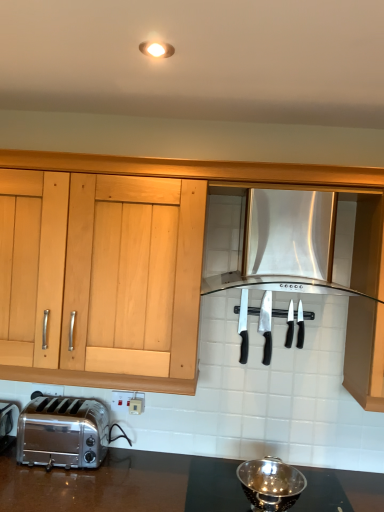
What do you see at coordinates (266, 325) in the screenshot? I see `polished stainless steel knife at center, the 2th silverware from the left` at bounding box center [266, 325].

Find the location of a particular element. This screenshot has width=384, height=512. black plastic knives at center, which is the third silverware in left-to-right order is located at coordinates (290, 326).

At what (x,y) coordinates should I click in order to perform the action: click on metallic reflective colander at lower center. Please return your answer as a coordinate pair (x, y). This screenshot has height=512, width=384. Looking at the image, I should click on (270, 484).

Considering the sizes of black plastic knives at center, which is the third silverware in left-to-right order, and stainless steel range hood at center in the image, is black plastic knives at center, which is the third silverware in left-to-right order, bigger or smaller than stainless steel range hood at center?

In the image, black plastic knives at center, which is the third silverware in left-to-right order, appears to be smaller than stainless steel range hood at center.

Considering the sizes of objects black plastic knives at center, placed as the second silverware when sorted from right to left, and stainless steel range hood at center in the image provided, who is wider, black plastic knives at center, placed as the second silverware when sorted from right to left, or stainless steel range hood at center?

stainless steel range hood at center.

Image resolution: width=384 pixels, height=512 pixels. What are the coordinates of `kitchen appliance in front of the black plastic knives at center, placed as the second silverware when sorted from right to left` in the screenshot? It's located at (295, 245).

Which point is more distant from viewer, [327,264] or [290,332]?

Point [290,332]

Could you tell me if stainless steel range hood at center is facing black plastic knives at center, which is the third silverware in left-to-right order?

No.

Is stainless steel range hood at center inside the boundaries of black plastic knives at center, which is the third silverware in left-to-right order, or outside?

stainless steel range hood at center is outside black plastic knives at center, which is the third silverware in left-to-right order.

From the image's perspective, between stainless steel range hood at center and black plastic knives at center, which is the third silverware in left-to-right order, who is located below?

black plastic knives at center, which is the third silverware in left-to-right order, from the image's perspective.

Does satin silver toaster at lower left appear on the right side of stainless steel range hood at center?

No, satin silver toaster at lower left is not to the right of stainless steel range hood at center.

Consider the image. From the image's perspective, is satin silver toaster at lower left on top of stainless steel range hood at center?

No.

Is satin silver toaster at lower left turned away from stainless steel range hood at center?

satin silver toaster at lower left is not turned away from stainless steel range hood at center.

Image resolution: width=384 pixels, height=512 pixels. I want to click on kitchen appliance above the satin silver toaster at lower left (from the image's perspective), so click(x=295, y=245).

How different are the orientations of polished stainless steel knife at center, the 2th silverware from the left, and silver metallic knife at center, which ranks as the first silverware in left-to-right order, in degrees?

They differ by 2.4 degrees in their facing directions.

Is polished stainless steel knife at center, which is counted as the 3th silverware, starting from the right, touching silver metallic knife at center, the 4th silverware from the right?

Yes, polished stainless steel knife at center, which is counted as the 3th silverware, starting from the right, is next to silver metallic knife at center, the 4th silverware from the right.

Is polished stainless steel knife at center, the 2th silverware from the left, positioned with its back to silver metallic knife at center, which ranks as the first silverware in left-to-right order?

No, polished stainless steel knife at center, the 2th silverware from the left,'s orientation is not away from silver metallic knife at center, which ranks as the first silverware in left-to-right order.

From the image's perspective, is polished stainless steel knife at center, the 2th silverware from the left, over silver metallic knife at center, the 4th silverware from the right?

No.

Are black plastic knives at center, which is the third silverware in left-to-right order, and metallic reflective colander at lower center far apart?

black plastic knives at center, which is the third silverware in left-to-right order, is actually quite close to metallic reflective colander at lower center.

From the image's perspective, between black plastic knives at center, which is the third silverware in left-to-right order, and metallic reflective colander at lower center, who is located below?

metallic reflective colander at lower center.

From a real-world perspective, which is physically below, black plastic knives at center, which is the third silverware in left-to-right order, or metallic reflective colander at lower center?

metallic reflective colander at lower center, from a real-world perspective.

From the image's perspective, starting from the metallic reflective colander at lower center, which silverware is the 3rd one above? Please provide its 2D coordinates.

[(290, 326)]

From the image's perspective, is stainless steel range hood at center on metallic reflective colander at lower center?

Indeed, from the image's perspective, stainless steel range hood at center is shown above metallic reflective colander at lower center.

Can you confirm if stainless steel range hood at center is shorter than metallic reflective colander at lower center?

No, stainless steel range hood at center is not shorter than metallic reflective colander at lower center.

Considering the positions of objects stainless steel range hood at center and metallic reflective colander at lower center in the image provided, who is behind, stainless steel range hood at center or metallic reflective colander at lower center?

metallic reflective colander at lower center is further from the camera.

Which object is positioned more to the right, black plastic knives at center, arranged as the 4th silverware when viewed from the left, or black plastic knives at center, placed as the second silverware when sorted from right to left?

black plastic knives at center, arranged as the 4th silverware when viewed from the left, is more to the right.

Based on the photo, from the image's perspective, is black plastic knives at center, marked as the first silverware in a right-to-left arrangement, beneath black plastic knives at center, placed as the second silverware when sorted from right to left?

Yes, from the image's perspective, black plastic knives at center, marked as the first silverware in a right-to-left arrangement, is below black plastic knives at center, placed as the second silverware when sorted from right to left.

Is black plastic knives at center, arranged as the 4th silverware when viewed from the left, beside black plastic knives at center, which is the third silverware in left-to-right order?

Yes, black plastic knives at center, arranged as the 4th silverware when viewed from the left, is touching black plastic knives at center, which is the third silverware in left-to-right order.

Where is `the 3rd silverware behind the stainless steel range hood at center, counting from the anchor's position`? the 3rd silverware behind the stainless steel range hood at center, counting from the anchor's position is located at coordinates (290, 326).

From a real-world perspective, which silverware is the 1st one underneath the stainless steel range hood at center? Please provide its 2D coordinates.

[(290, 326)]

Looking at the image, which one is located further to stainless steel range hood at center, silver metallic knife at center, the 4th silverware from the right, or satin silver toaster at lower left?

Among the two, satin silver toaster at lower left is located further to stainless steel range hood at center.

Looking at the image, which one is located further to polished stainless steel knife at center, the 2th silverware from the left, black plastic knives at center, arranged as the 4th silverware when viewed from the left, or black plastic knives at center, which is the third silverware in left-to-right order?

Among the two, black plastic knives at center, arranged as the 4th silverware when viewed from the left, is located further to polished stainless steel knife at center, the 2th silverware from the left.

From the picture: Based on their spatial positions, is silver metallic knife at center, which ranks as the first silverware in left-to-right order, or stainless steel range hood at center further from satin silver toaster at lower left?

stainless steel range hood at center is positioned further to the anchor satin silver toaster at lower left.

From the image, which object appears to be farther from polished stainless steel knife at center, the 2th silverware from the left, silver metallic knife at center, which ranks as the first silverware in left-to-right order, or metallic reflective colander at lower center?

metallic reflective colander at lower center.

Based on their spatial positions, is metallic reflective colander at lower center or black plastic knives at center, placed as the second silverware when sorted from right to left, further from silver metallic knife at center, which ranks as the first silverware in left-to-right order?

metallic reflective colander at lower center is positioned further to the anchor silver metallic knife at center, which ranks as the first silverware in left-to-right order.

Considering their positions, is black plastic knives at center, placed as the second silverware when sorted from right to left, positioned closer to metallic reflective colander at lower center than stainless steel range hood at center?

black plastic knives at center, placed as the second silverware when sorted from right to left.

Based on the photo, based on their spatial positions, is satin silver toaster at lower left or black plastic knives at center, marked as the first silverware in a right-to-left arrangement, closer to black plastic knives at center, placed as the second silverware when sorted from right to left?

black plastic knives at center, marked as the first silverware in a right-to-left arrangement, lies closer to black plastic knives at center, placed as the second silverware when sorted from right to left, than the other object.

When comparing their distances from black plastic knives at center, placed as the second silverware when sorted from right to left, does metallic reflective colander at lower center or satin silver toaster at lower left seem closer?

metallic reflective colander at lower center is positioned closer to the anchor black plastic knives at center, placed as the second silverware when sorted from right to left.

Find the location of `silverware located between stainless steel range hood at center and black plastic knives at center, arranged as the 4th silverware when viewed from the left, in the depth direction`. silverware located between stainless steel range hood at center and black plastic knives at center, arranged as the 4th silverware when viewed from the left, in the depth direction is located at coordinates (266, 325).

The width and height of the screenshot is (384, 512). I want to click on silverware between black plastic knives at center, arranged as the 4th silverware when viewed from the left, and metallic reflective colander at lower center from top to bottom, so click(266, 325).

You are a GUI agent. You are given a task and a screenshot of the screen. Output one action in this format:
    pyautogui.click(x=<x>, y=<y>)
    Task: Click on the toaster between stainless steel range hood at center and metallic reflective colander at lower center from top to bottom
    The width and height of the screenshot is (384, 512).
    Given the screenshot: What is the action you would take?
    pyautogui.click(x=63, y=432)

Locate an element on the screen. The image size is (384, 512). silverware between silver metallic knife at center, which ranks as the first silverware in left-to-right order, and black plastic knives at center, placed as the second silverware when sorted from right to left, in the horizontal direction is located at coordinates (266, 325).